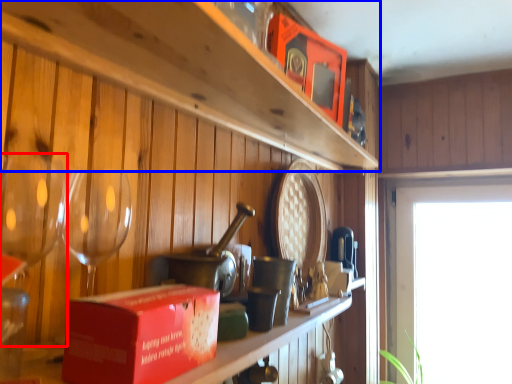
Question: Which point is further to the camera, wine glass (highlighted by a red box) or shelf (highlighted by a blue box)?

Choices:
 (A) wine glass
 (B) shelf

Answer: (A)